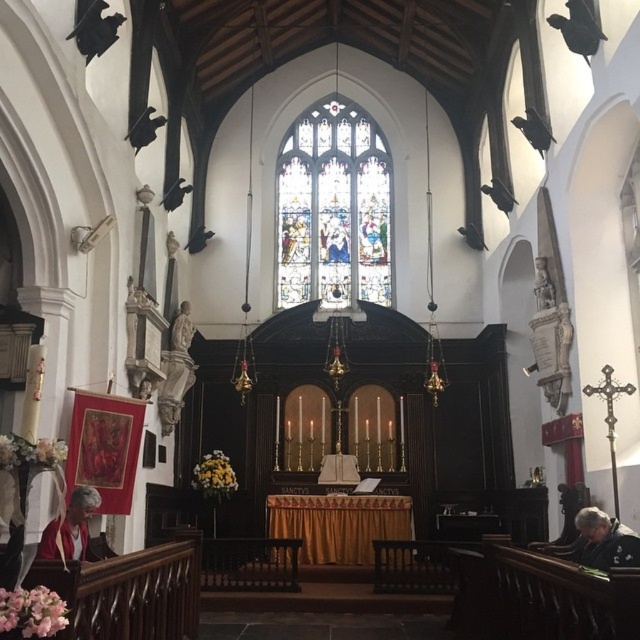
You are standing in the church and see two points marked in the image. Which point is closer to you, point (300, 241) or point (593, 509)?

Point (300, 241) is closer to you than point (593, 509) because it is further to the viewer.

You are standing in the church and want to know how far the point at coordinates point (378, 243) is from where you are standing. Can you determine the distance?

The distance of point (378, 243) from camera is 314.19 feet.